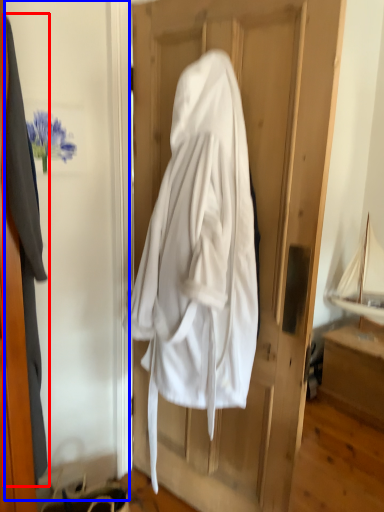
Question: Which object is further to the camera taking this photo, garment (highlighted by a red box) or screen door (highlighted by a blue box)?

Choices:
 (A) garment
 (B) screen door

Answer: (A)